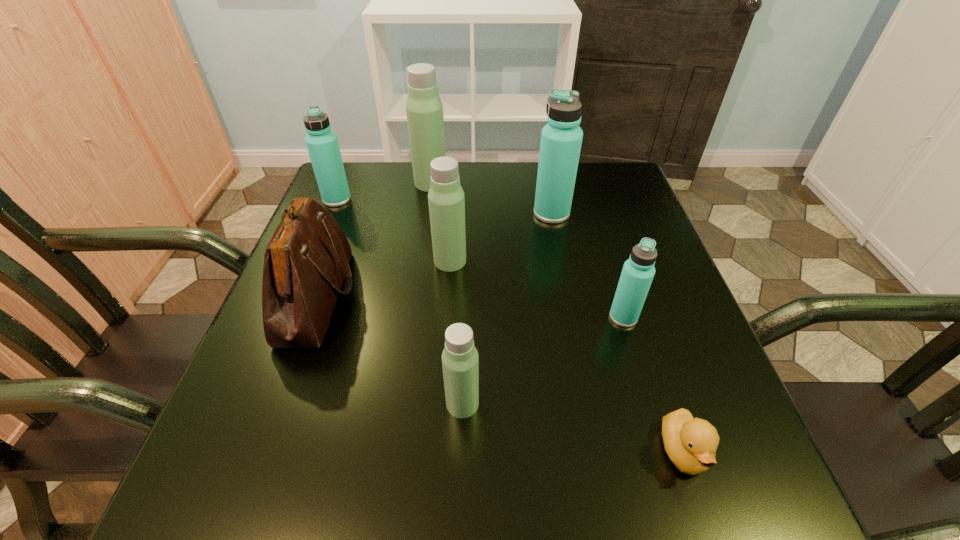
At what (x,y) coordinates should I click in order to perform the action: click on free space at the left edge. Please return your answer as a coordinate pair (x, y). This screenshot has width=960, height=540. Looking at the image, I should click on (247, 360).

Image resolution: width=960 pixels, height=540 pixels. I want to click on vacant space at the right edge of the desktop, so click(x=639, y=216).

In the image, there is a desktop. Where is `vacant area at the near right corner`? The height and width of the screenshot is (540, 960). vacant area at the near right corner is located at coordinates (694, 500).

I want to click on vacant area that lies between the second aqua thermos bottle from left to right and the farthest light thermos bottle, so 492,198.

The width and height of the screenshot is (960, 540). In order to click on vacant area that lies between the farthest light thermos bottle and the nearest thermos bottle in this screenshot , I will do `click(446, 293)`.

The width and height of the screenshot is (960, 540). I want to click on unoccupied area between the nearest light thermos bottle and the nearest object, so click(x=573, y=428).

I want to click on vacant space that's between the nearest object and the second thermos bottle from right to left, so click(617, 332).

At what (x,y) coordinates should I click in order to perform the action: click on free space that is in between the leftmost thermos bottle and the biggest light thermos bottle. Please return your answer as a coordinate pair (x, y). The image size is (960, 540). Looking at the image, I should click on (384, 191).

Where is `free space between the biggest light thermos bottle and the second nearest thermos bottle`? Image resolution: width=960 pixels, height=540 pixels. free space between the biggest light thermos bottle and the second nearest thermos bottle is located at coordinates (527, 250).

What are the coordinates of `vacant space that's between the biggest light thermos bottle and the duckling` in the screenshot? It's located at (557, 317).